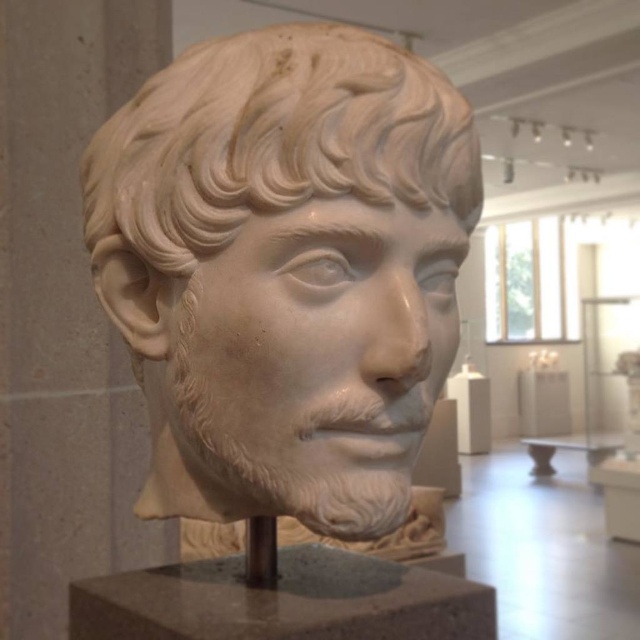
Between point (160, 365) and point (131, 582), which one is positioned behind?

Point (131, 582)

Measure the distance between point (234, 500) and camera.

Point (234, 500) is 36.22 inches away from camera.

Identify the location of white marble bust at center. click(x=285, y=269).